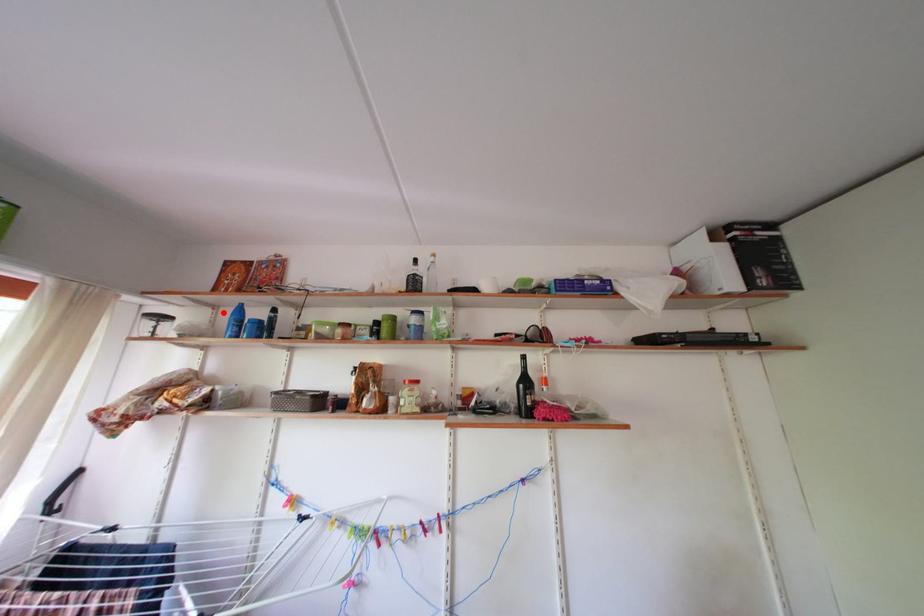
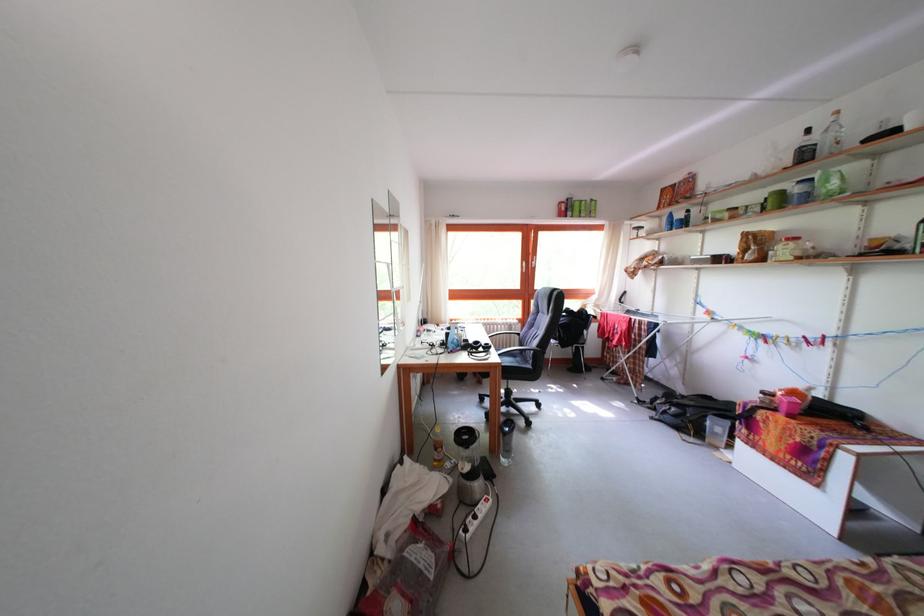
Locate, in the second image, the point that corresponds to the highlighted location in the first image.

(667, 224)